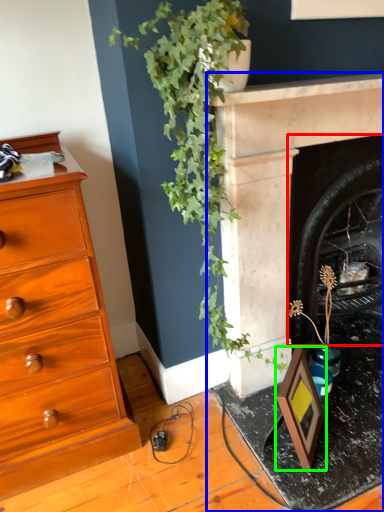
Question: Estimate the real-world distances between objects in this image. Which object is farther from fireplace (highlighted by a red box), fireplace (highlighted by a blue box) or picture frame (highlighted by a green box)?

Choices:
 (A) fireplace
 (B) picture frame

Answer: (B)